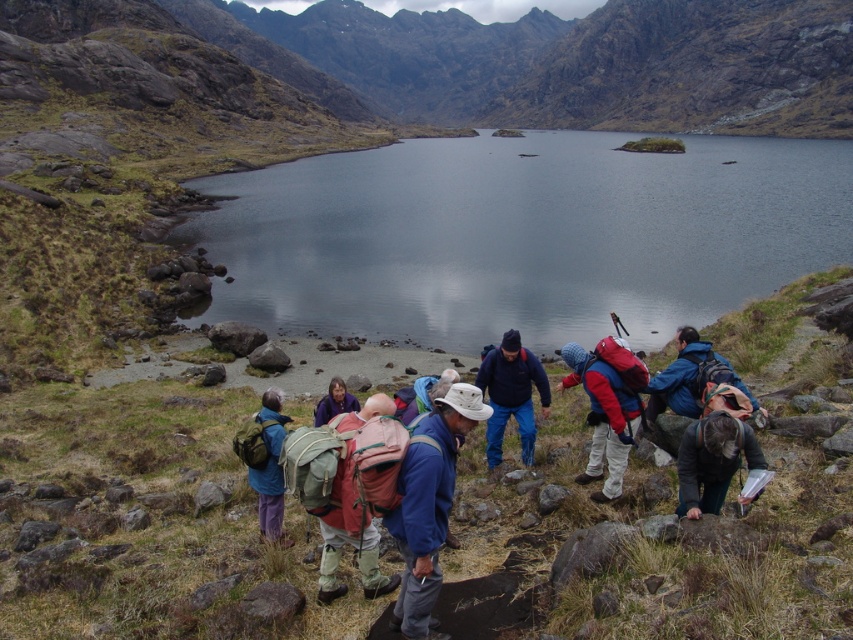
Question: Among these objects, which one is nearest to the camera?

Choices:
 (A) red backpack at center
 (B) green fabric backpack at center
 (C) matte green backpack at center
 (D) blue fleece jacket at center

Answer: (B)

Question: Does matte pink backpack at center have a lesser width compared to blue fabric backpack at center?

Choices:
 (A) yes
 (B) no

Answer: (A)

Question: Which object is farther from the camera taking this photo?

Choices:
 (A) green fabric backpack at center
 (B) blue fabric backpack at center

Answer: (B)

Question: Which object appears farthest from the camera in this image?

Choices:
 (A) blue fabric jacket at center
 (B) green fabric backpack at center
 (C) red backpack at center
 (D) matte pink backpack at center

Answer: (C)

Question: In this image, where is smooth reflective water at center located relative to matte pink backpack at center?

Choices:
 (A) right
 (B) left

Answer: (A)

Question: In this image, where is blue fabric jacket at center located relative to matte purple jacket at center?

Choices:
 (A) left
 (B) right

Answer: (B)